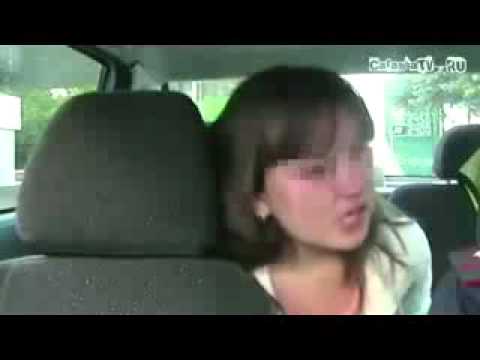
Where is `seat`? Image resolution: width=480 pixels, height=360 pixels. seat is located at coordinates (180, 323).